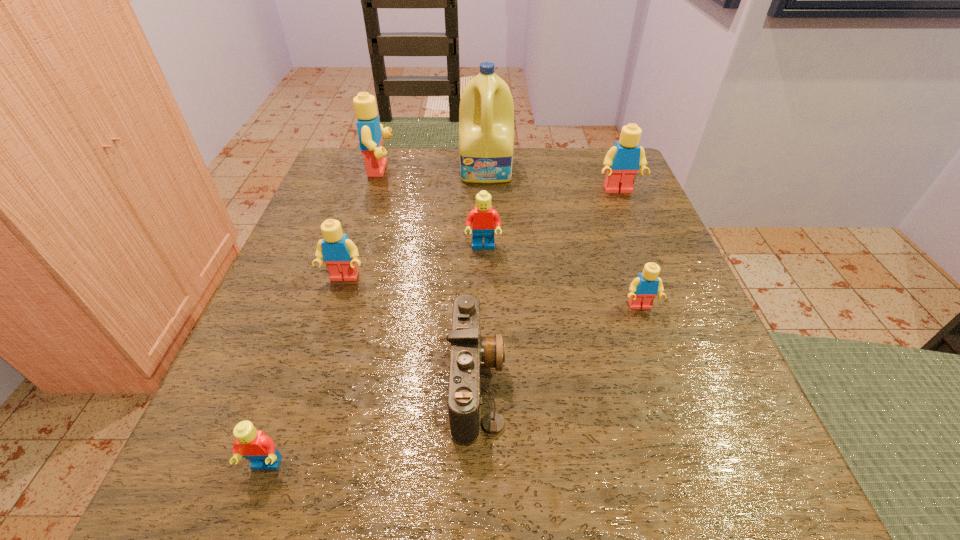
You are a GUI agent. You are given a task and a screenshot of the screen. Output one action in this format:
    pyautogui.click(x=<x>, y=<y>)
    Task: Click on the fifth closest object to the third farthest yellow Lego
    
    Given the screenshot: What is the action you would take?
    pyautogui.click(x=486, y=114)

Where is `object that ranks as the seventh closest to the left red Lego`? This screenshot has width=960, height=540. object that ranks as the seventh closest to the left red Lego is located at coordinates (622, 161).

Select which Lego is the second closest to the right red Lego. Please provide its 2D coordinates. Your answer should be formatted as a tuple, i.e. [(x, y)], where the tuple contains the x and y coordinates of a point satisfying the conditions above.

[(643, 289)]

At what (x,y) coordinates should I click in order to perform the action: click on Lego object that ranks as the fourth closest to the farthest yellow Lego. Please return your answer as a coordinate pair (x, y). Looking at the image, I should click on (643, 289).

Identify which yellow Lego is the third nearest to the second smallest yellow Lego. Please provide its 2D coordinates. Your answer should be formatted as a tuple, i.e. [(x, y)], where the tuple contains the x and y coordinates of a point satisfying the conditions above.

[(622, 161)]

Where is `yellow Lego identified as the third closest to the fourth farthest Lego`? yellow Lego identified as the third closest to the fourth farthest Lego is located at coordinates (622, 161).

Identify the location of blank space that satisfies the following two spatial constraints: 1. on the front-facing side of the nearest yellow Lego; 2. on the front-facing side of the camera. Image resolution: width=960 pixels, height=540 pixels. (666, 381).

Identify the location of free point that satisfies the following two spatial constraints: 1. on the front-facing side of the third nearest object; 2. on the front-facing side of the second nearest object. This screenshot has width=960, height=540. (666, 381).

Where is `vacant region that satisfies the following two spatial constraints: 1. on the face of the bigger red Lego; 2. on the front-facing side of the seventh farthest object`? The height and width of the screenshot is (540, 960). vacant region that satisfies the following two spatial constraints: 1. on the face of the bigger red Lego; 2. on the front-facing side of the seventh farthest object is located at coordinates (484, 381).